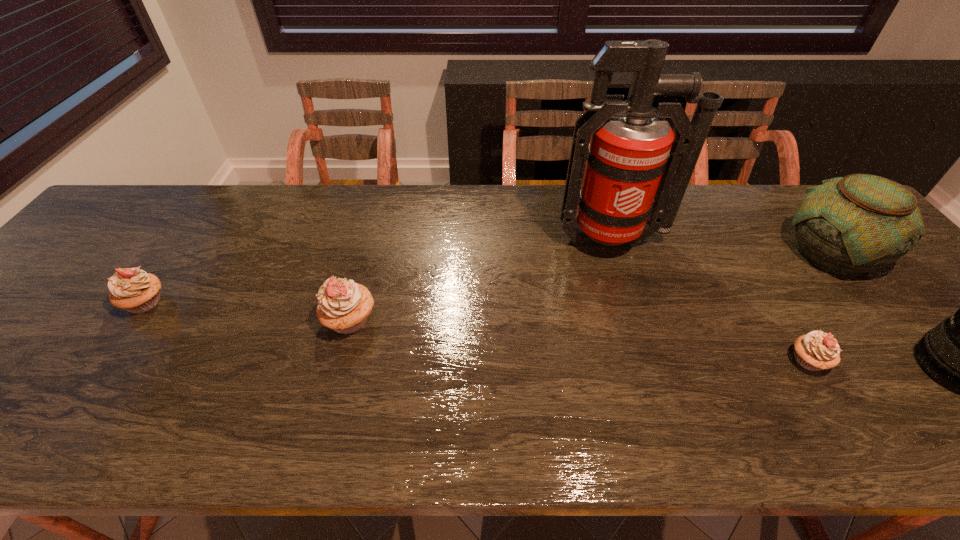
Identify the location of the leftmost cupcake. (132, 289).

Where is `the second shortest object`? the second shortest object is located at coordinates (132, 289).

This screenshot has width=960, height=540. Identify the location of the second cupcake from left to right. (344, 306).

You are a GUI agent. You are given a task and a screenshot of the screen. Output one action in this format:
    pyautogui.click(x=<x>, y=<y>)
    Task: Click on the tallest cupcake
    The image size is (960, 540).
    Given the screenshot: What is the action you would take?
    pyautogui.click(x=344, y=306)

The height and width of the screenshot is (540, 960). I want to click on the nearest cupcake, so tap(817, 350).

Locate an element on the screen. the shortest cupcake is located at coordinates (817, 350).

You are a GUI agent. You are given a task and a screenshot of the screen. Output one action in this format:
    pyautogui.click(x=<x>, y=<y>)
    Task: Click on the fourth object from right to left
    The width and height of the screenshot is (960, 540).
    Given the screenshot: What is the action you would take?
    pyautogui.click(x=637, y=170)

This screenshot has width=960, height=540. Find the location of `fire extinguisher`. fire extinguisher is located at coordinates (637, 170).

The image size is (960, 540). Find the location of `pottery`. pottery is located at coordinates (850, 225).

You are a GUI agent. You are given a task and a screenshot of the screen. Output one action in this format:
    pyautogui.click(x=<x>, y=<y>)
    Task: Click on the free space located 0.150m on the left of the leftmost cupcake
    This screenshot has width=960, height=540.
    Given the screenshot: What is the action you would take?
    pyautogui.click(x=61, y=303)